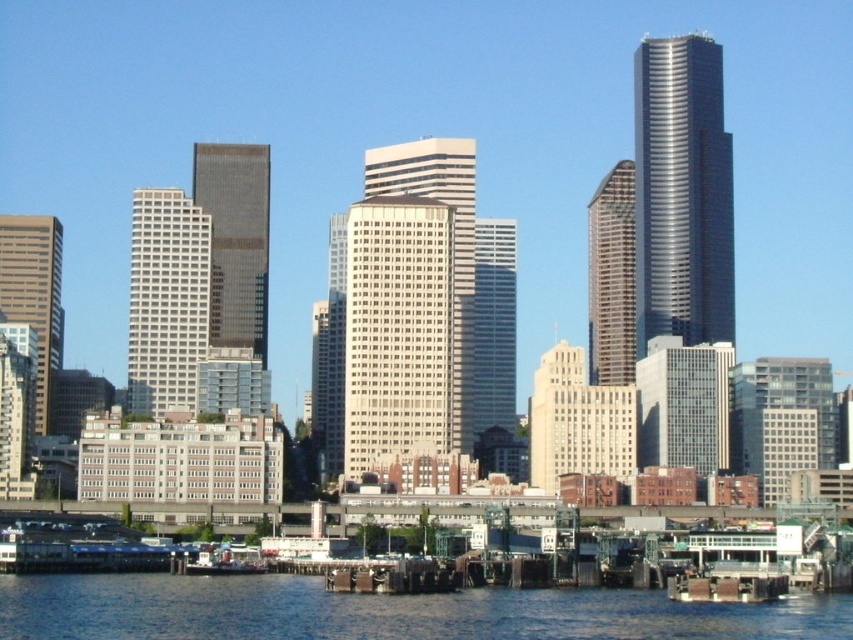
You are an architect who wants to place a new sculpture between the dark gray glass skyscraper at center and the clear glass skyscraper at center. According to the scene, which skyscraper should the sculpture be closer to if you want it to be aligned with the tallest building in the image?

The tallest building is the dark metallic skyscraper on the right side. The sculpture should be closer to the clear glass skyscraper at center since the dark gray glass skyscraper at center is to its left, and aligning with the tallest building would require positioning towards the right side of the scene.

You are a photographer planning to take a wide shot of the city skyline. You want to ensure that both the blue water at lower center and the metallic gray boat at lower left are clearly visible in the frame. Given their sizes, which object should you focus on to include both in the composition without cropping?

The blue water at lower center is larger in size than the metallic gray boat at lower left, so focusing on the blue water at lower center will allow both objects to fit within the frame while maintaining their visibility.